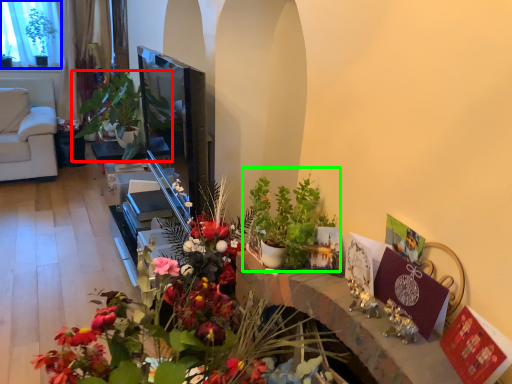
Question: Based on their relative distances, which object is farther from houseplant (highlighted by a red box)? Choose from window screen (highlighted by a blue box) and houseplant (highlighted by a green box).

Choices:
 (A) window screen
 (B) houseplant

Answer: (B)